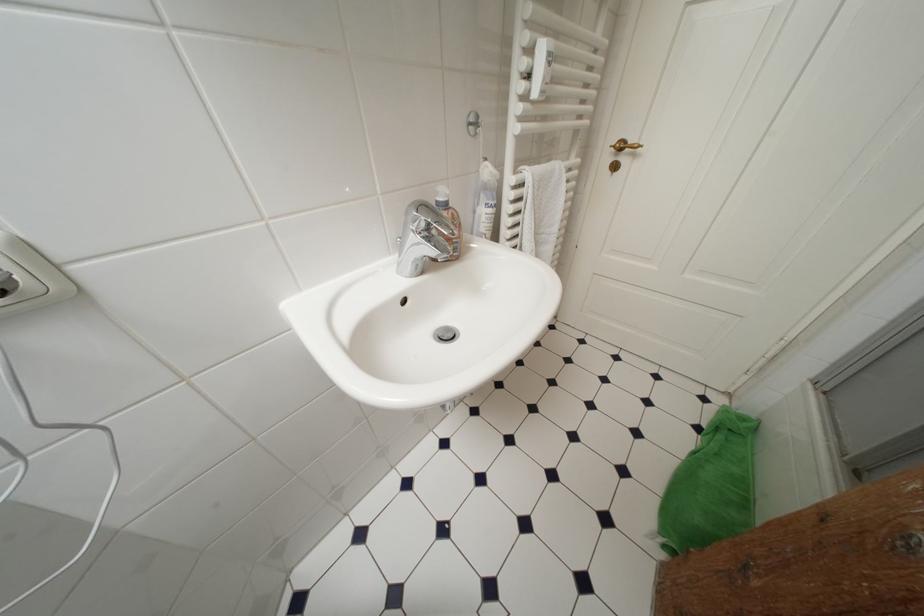
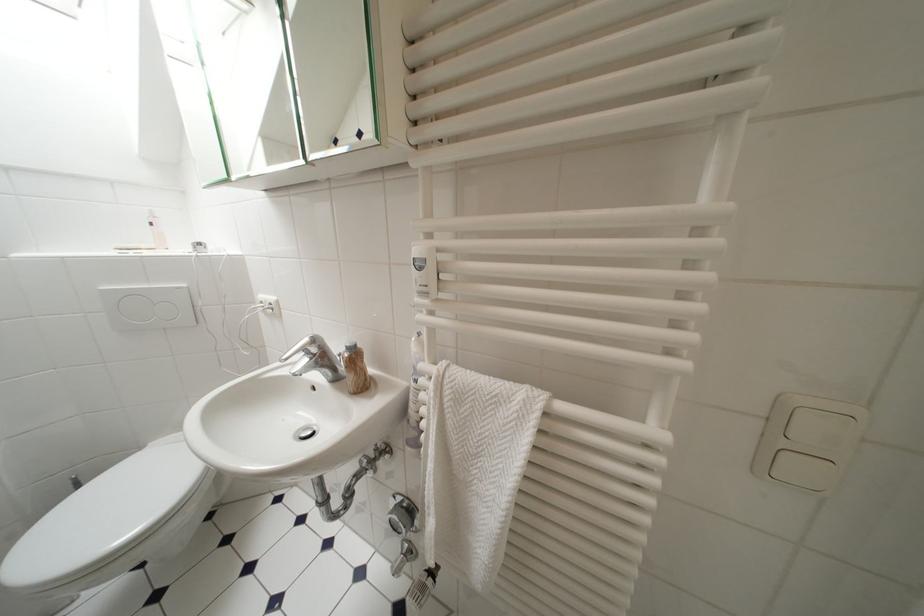
Locate, in the second image, the point that corresponds to the point at 538,195 in the first image.

(439, 397)